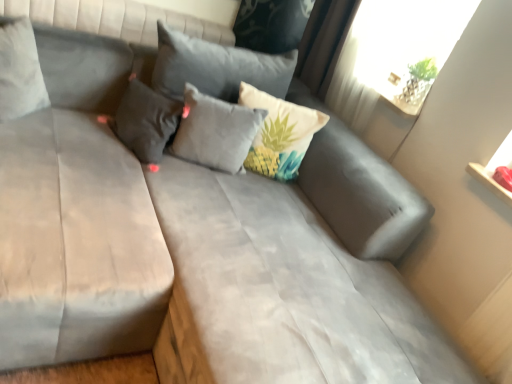
What do you see at coordinates (280, 134) in the screenshot? Image resolution: width=512 pixels, height=384 pixels. I see `beige fabric pillow with tropical print at center, the 4th pillow when ordered from left to right` at bounding box center [280, 134].

In order to face beige fabric pillow with tropical print at center, acting as the first pillow starting from the right, should I rotate leftwards or rightwards?

Turn right approximately 2.693 degrees to face it.

The width and height of the screenshot is (512, 384). Describe the element at coordinates (20, 71) in the screenshot. I see `suede gray pillow at upper left, which ranks as the first pillow in left-to-right order` at that location.

The height and width of the screenshot is (384, 512). What do you see at coordinates (146, 121) in the screenshot? I see `dark gray fabric pillow at upper left, the second pillow viewed from the left` at bounding box center [146, 121].

What do you see at coordinates (281, 292) in the screenshot?
I see `suede gray mattress at center, the 1th mattress when ordered from right to left` at bounding box center [281, 292].

Where is `beige fabric pillow with tropical print at center, the 4th pillow when ordered from left to right`? The width and height of the screenshot is (512, 384). beige fabric pillow with tropical print at center, the 4th pillow when ordered from left to right is located at coordinates (280, 134).

Find the location of a particular element. This screenshot has width=512, height=384. the 1st pillow behind when counting from the suede gray mattress at left, placed as the 2th mattress when sorted from right to left is located at coordinates (20, 71).

Based on their positions, is suede gray mattress at left, the 1th mattress when ordered from left to right, located to the left or right of suede gray pillow at upper left, which ranks as the first pillow in left-to-right order?

Clearly, suede gray mattress at left, the 1th mattress when ordered from left to right, is on the right of suede gray pillow at upper left, which ranks as the first pillow in left-to-right order, in the image.

Which object is closer to the camera, suede gray mattress at left, the 1th mattress when ordered from left to right, or suede gray pillow at upper left, marked as the 4th pillow in a right-to-left arrangement?

suede gray mattress at left, the 1th mattress when ordered from left to right.

Is suede gray mattress at left, placed as the 2th mattress when sorted from right to left, oriented away from beige fabric pillow with tropical print at center, acting as the first pillow starting from the right?

No, suede gray mattress at left, placed as the 2th mattress when sorted from right to left, is not facing the opposite direction of beige fabric pillow with tropical print at center, acting as the first pillow starting from the right.

From a real-world perspective, is suede gray mattress at left, the 1th mattress when ordered from left to right, positioned over beige fabric pillow with tropical print at center, acting as the first pillow starting from the right, based on gravity?

No, from a real-world perspective, suede gray mattress at left, the 1th mattress when ordered from left to right, is not above beige fabric pillow with tropical print at center, acting as the first pillow starting from the right.

Locate an element on the screen. The height and width of the screenshot is (384, 512). the 4th pillow behind the suede gray mattress at left, placed as the 2th mattress when sorted from right to left, starting your count from the anchor is located at coordinates (280, 134).

Is suede gray mattress at left, placed as the 2th mattress when sorted from right to left, surrounding beige fabric pillow with tropical print at center, the 4th pillow when ordered from left to right?

Actually, beige fabric pillow with tropical print at center, the 4th pillow when ordered from left to right, is outside suede gray mattress at left, placed as the 2th mattress when sorted from right to left.

From a real-world perspective, is beige fabric pillow with tropical print at center, the 4th pillow when ordered from left to right, below dark gray fabric pillow at upper left, placed as the 3th pillow when sorted from right to left?

Actually, beige fabric pillow with tropical print at center, the 4th pillow when ordered from left to right, is physically above dark gray fabric pillow at upper left, placed as the 3th pillow when sorted from right to left, in the real world.

In the scene shown: Which of these two, beige fabric pillow with tropical print at center, the 4th pillow when ordered from left to right, or dark gray fabric pillow at upper left, placed as the 3th pillow when sorted from right to left, is thinner?

beige fabric pillow with tropical print at center, the 4th pillow when ordered from left to right.

Is beige fabric pillow with tropical print at center, the 4th pillow when ordered from left to right, touching dark gray fabric pillow at upper left, placed as the 3th pillow when sorted from right to left?

No, beige fabric pillow with tropical print at center, the 4th pillow when ordered from left to right, is not in contact with dark gray fabric pillow at upper left, placed as the 3th pillow when sorted from right to left.

Between beige fabric pillow with tropical print at center, acting as the first pillow starting from the right, and dark gray fabric pillow at upper left, the second pillow viewed from the left, which one has larger size?

Bigger between the two is beige fabric pillow with tropical print at center, acting as the first pillow starting from the right.

Choose the correct answer: Is dark gray fabric pillow at upper left, placed as the 3th pillow when sorted from right to left, inside beige fabric pillow with tropical print at center, the 4th pillow when ordered from left to right, or outside it?

dark gray fabric pillow at upper left, placed as the 3th pillow when sorted from right to left, exists outside the volume of beige fabric pillow with tropical print at center, the 4th pillow when ordered from left to right.

Is dark gray fabric pillow at upper left, the second pillow viewed from the left, taller than beige fabric pillow with tropical print at center, acting as the first pillow starting from the right?

No, dark gray fabric pillow at upper left, the second pillow viewed from the left, is not taller than beige fabric pillow with tropical print at center, acting as the first pillow starting from the right.

How far apart are dark gray fabric pillow at upper left, the second pillow viewed from the left, and beige fabric pillow with tropical print at center, the 4th pillow when ordered from left to right?

17.00 inches.

Is dark gray fabric pillow at upper left, placed as the 3th pillow when sorted from right to left, at the right side of beige fabric pillow with tropical print at center, the 4th pillow when ordered from left to right?

In fact, dark gray fabric pillow at upper left, placed as the 3th pillow when sorted from right to left, is to the left of beige fabric pillow with tropical print at center, the 4th pillow when ordered from left to right.

Is suede gray mattress at center, the second mattress from the left, positioned with its back to light gray fabric pillow at center, which is the third pillow from left to right?

No.

Is point (330, 315) positioned before point (186, 90)?

Yes.

From the image's perspective, relative to light gray fabric pillow at center, which is the third pillow from left to right, is suede gray mattress at center, the second mattress from the left, above or below?

suede gray mattress at center, the second mattress from the left, is below light gray fabric pillow at center, which is the third pillow from left to right.

I want to click on the 2nd mattress below when counting from the light gray fabric pillow at center, the 2th pillow when ordered from right to left (from the image's perspective), so click(281, 292).

Is dark gray fabric pillow at upper left, placed as the 3th pillow when sorted from right to left, thinner than suede gray mattress at left, placed as the 2th mattress when sorted from right to left?

Yes, dark gray fabric pillow at upper left, placed as the 3th pillow when sorted from right to left, is thinner than suede gray mattress at left, placed as the 2th mattress when sorted from right to left.

From a real-world perspective, is dark gray fabric pillow at upper left, placed as the 3th pillow when sorted from right to left, positioned above or below suede gray mattress at left, placed as the 2th mattress when sorted from right to left?

In terms of real-world spatial position, dark gray fabric pillow at upper left, placed as the 3th pillow when sorted from right to left, is above suede gray mattress at left, placed as the 2th mattress when sorted from right to left.

Considering the relative sizes of dark gray fabric pillow at upper left, placed as the 3th pillow when sorted from right to left, and suede gray mattress at left, the 1th mattress when ordered from left to right, in the image provided, is dark gray fabric pillow at upper left, placed as the 3th pillow when sorted from right to left, bigger than suede gray mattress at left, the 1th mattress when ordered from left to right,?

Incorrect, dark gray fabric pillow at upper left, placed as the 3th pillow when sorted from right to left, is not larger than suede gray mattress at left, the 1th mattress when ordered from left to right.

Identify the location of mattress lying on the left of dark gray fabric pillow at upper left, the second pillow viewed from the left. The width and height of the screenshot is (512, 384). (75, 243).

Between suede gray mattress at left, the 1th mattress when ordered from left to right, and transparent glass window screen at upper right, which one has larger size?

With larger size is suede gray mattress at left, the 1th mattress when ordered from left to right.

From a real-world perspective, is suede gray mattress at left, placed as the 2th mattress when sorted from right to left, on transparent glass window screen at upper right?

No.

From the image's perspective, which one is positioned lower, suede gray mattress at left, placed as the 2th mattress when sorted from right to left, or transparent glass window screen at upper right?

suede gray mattress at left, placed as the 2th mattress when sorted from right to left, is shown below in the image.

Between suede gray mattress at left, placed as the 2th mattress when sorted from right to left, and transparent glass window screen at upper right, which one is positioned in front?

suede gray mattress at left, placed as the 2th mattress when sorted from right to left, is more forward.

There is a suede gray pillow at upper left, marked as the 4th pillow in a right-to-left arrangement. Identify the location of the 1st mattress below it (from a real-world perspective). (75, 243).

Which pillow is the 3rd one when counting from the right side of the suede gray mattress at left, placed as the 2th mattress when sorted from right to left? Please provide its 2D coordinates.

[(280, 134)]

Looking at the image, which one is located closer to suede gray mattress at center, the 1th mattress when ordered from right to left, transparent glass window screen at upper right or light gray fabric pillow at center, the 2th pillow when ordered from right to left?

light gray fabric pillow at center, the 2th pillow when ordered from right to left, is positioned closer to the anchor suede gray mattress at center, the 1th mattress when ordered from right to left.

Based on their spatial positions, is light gray fabric pillow at center, the 2th pillow when ordered from right to left, or suede gray mattress at center, the second mattress from the left, closer to suede gray pillow at upper left, which ranks as the first pillow in left-to-right order?

light gray fabric pillow at center, the 2th pillow when ordered from right to left, is closer to suede gray pillow at upper left, which ranks as the first pillow in left-to-right order.

Estimate the real-world distances between objects in this image. Which object is closer to beige fabric pillow with tropical print at center, the 4th pillow when ordered from left to right, suede gray pillow at upper left, which ranks as the first pillow in left-to-right order, or light gray fabric pillow at center, which is the third pillow from left to right?

Based on the image, light gray fabric pillow at center, which is the third pillow from left to right, appears to be nearer to beige fabric pillow with tropical print at center, the 4th pillow when ordered from left to right.

Considering their positions, is transparent glass window screen at upper right positioned further to dark gray fabric pillow at upper left, placed as the 3th pillow when sorted from right to left, than beige fabric pillow with tropical print at center, the 4th pillow when ordered from left to right?

The object further to dark gray fabric pillow at upper left, placed as the 3th pillow when sorted from right to left, is transparent glass window screen at upper right.

Which object lies further to the anchor point beige fabric pillow with tropical print at center, the 4th pillow when ordered from left to right, suede gray mattress at left, the 1th mattress when ordered from left to right, or light gray fabric pillow at center, the 2th pillow when ordered from right to left?

suede gray mattress at left, the 1th mattress when ordered from left to right.

When comparing their distances from suede gray mattress at center, the 1th mattress when ordered from right to left, does dark gray fabric pillow at upper left, placed as the 3th pillow when sorted from right to left, or beige fabric pillow with tropical print at center, the 4th pillow when ordered from left to right, seem closer?

The object closer to suede gray mattress at center, the 1th mattress when ordered from right to left, is beige fabric pillow with tropical print at center, the 4th pillow when ordered from left to right.

Considering their positions, is transparent glass window screen at upper right positioned closer to dark gray fabric pillow at upper left, placed as the 3th pillow when sorted from right to left, than suede gray mattress at left, placed as the 2th mattress when sorted from right to left?

Among the two, suede gray mattress at left, placed as the 2th mattress when sorted from right to left, is located nearer to dark gray fabric pillow at upper left, placed as the 3th pillow when sorted from right to left.

Considering their positions, is beige fabric pillow with tropical print at center, the 4th pillow when ordered from left to right, positioned further to suede gray mattress at left, placed as the 2th mattress when sorted from right to left, than suede gray pillow at upper left, which ranks as the first pillow in left-to-right order?

beige fabric pillow with tropical print at center, the 4th pillow when ordered from left to right, is positioned further to the anchor suede gray mattress at left, placed as the 2th mattress when sorted from right to left.

Locate an element on the screen. The image size is (512, 384). window screen positioned between suede gray mattress at center, the 1th mattress when ordered from right to left, and beige fabric pillow with tropical print at center, acting as the first pillow starting from the right, from near to far is located at coordinates (405, 45).

Image resolution: width=512 pixels, height=384 pixels. What are the coordinates of `mattress located between suede gray mattress at center, the 1th mattress when ordered from right to left, and light gray fabric pillow at center, the 2th pillow when ordered from right to left, in the depth direction` in the screenshot? It's located at (75, 243).

This screenshot has width=512, height=384. In order to click on mattress situated between suede gray mattress at left, placed as the 2th mattress when sorted from right to left, and transparent glass window screen at upper right from left to right in this screenshot , I will do `click(281, 292)`.

I want to click on mattress located between suede gray mattress at center, the 1th mattress when ordered from right to left, and dark gray fabric pillow at upper left, the second pillow viewed from the left, in the depth direction, so click(x=75, y=243).